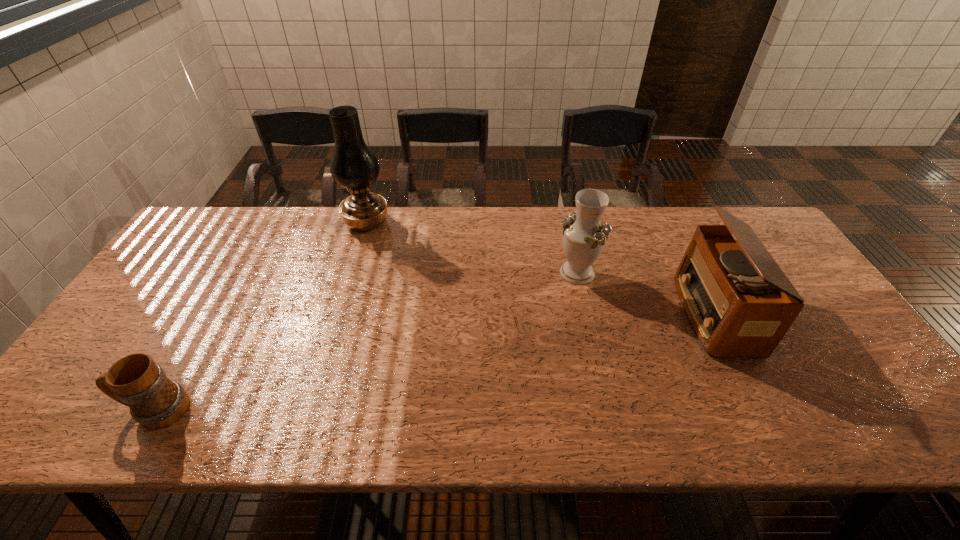
Where is `vacant region located 0.320m on the front panel of the rightmost object`? The image size is (960, 540). vacant region located 0.320m on the front panel of the rightmost object is located at coordinates (564, 314).

This screenshot has height=540, width=960. What are the coordinates of `vacant space located on the side of the nearest object with the handle` in the screenshot? It's located at (97, 410).

Identify the location of object that is at the far edge. (353, 166).

What are the coordinates of `object situated at the near edge` in the screenshot? It's located at click(156, 402).

Where is `object located at the left edge`? The height and width of the screenshot is (540, 960). object located at the left edge is located at coordinates (156, 402).

Identify the location of object located at the near left corner. (156, 402).

The width and height of the screenshot is (960, 540). I want to click on vacant position at the far edge of the desktop, so click(240, 242).

Where is `vacant position at the near edge of the desktop`? vacant position at the near edge of the desktop is located at coordinates (434, 405).

This screenshot has width=960, height=540. What are the coordinates of `vacant space at the left edge` in the screenshot? It's located at (132, 331).

In the image, there is a desktop. Where is `free space at the near left corner`? free space at the near left corner is located at coordinates (55, 438).